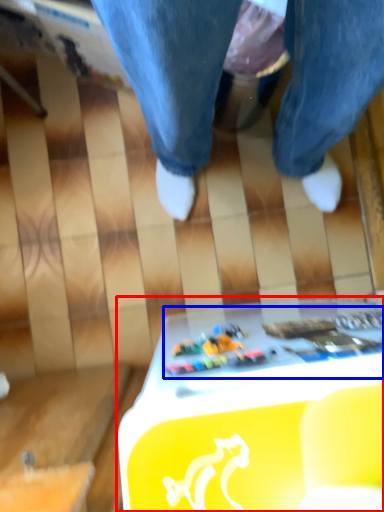
Question: Which of the following is the farthest to the observer, table (highlighted by a red box) or writing (highlighted by a blue box)?

Choices:
 (A) table
 (B) writing

Answer: (B)